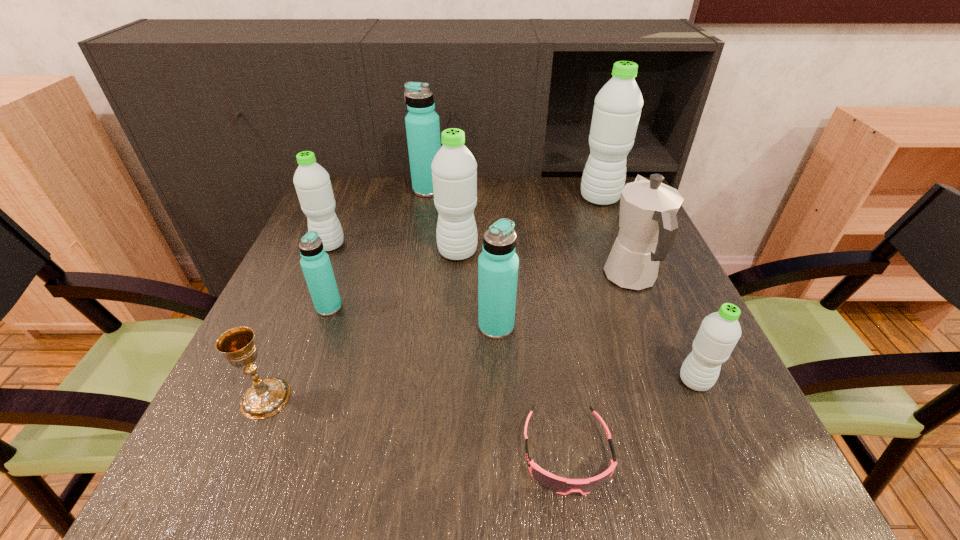
Identify the location of free area in between the fifth water bottle from right to left and the biggest green water bottle. (514, 194).

This screenshot has height=540, width=960. I want to click on free space between the third biggest green water bottle and the second shortest object, so click(x=298, y=322).

This screenshot has width=960, height=540. I want to click on free spot between the fifth water bottle from right to left and the chalice, so click(x=347, y=294).

You are a GUI agent. You are given a task and a screenshot of the screen. Output one action in this format:
    pyautogui.click(x=<x>, y=<y>)
    Task: Click on the free space between the gray coffeepot and the farthest blue water bottle
    This screenshot has height=540, width=960.
    Given the screenshot: What is the action you would take?
    pyautogui.click(x=530, y=234)

The image size is (960, 540). What are the coordinates of `empty space between the third green water bottle from right to left and the second smallest blue water bottle` in the screenshot? It's located at (477, 289).

Identify which object is located as the sixth nearest to the second biggest blue water bottle. Please provide its 2D coordinates. Your answer should be formatted as a tuple, i.e. [(x, y)], where the tuple contains the x and y coordinates of a point satisfying the conditions above.

[(265, 397)]

At what (x,y) coordinates should I click in order to perform the action: click on object that can be found as the fourth closest to the pink goggles. Please return your answer as a coordinate pair (x, y). The height and width of the screenshot is (540, 960). Looking at the image, I should click on (454, 169).

Select which water bottle appears as the second closest to the smallest green water bottle. Please provide its 2D coordinates. Your answer should be formatted as a tuple, i.e. [(x, y)], where the tuple contains the x and y coordinates of a point satisfying the conditions above.

[(454, 169)]

You are a GUI agent. You are given a task and a screenshot of the screen. Output one action in this format:
    pyautogui.click(x=<x>, y=<y>)
    Task: Click on the second closest water bottle to the second smallest green water bottle
    Image resolution: width=960 pixels, height=540 pixels.
    Given the screenshot: What is the action you would take?
    pyautogui.click(x=454, y=169)

Identify which green water bottle is the fourth closest to the chalice. Please provide its 2D coordinates. Your answer should be formatted as a tuple, i.e. [(x, y)], where the tuple contains the x and y coordinates of a point satisfying the conditions above.

[(617, 109)]